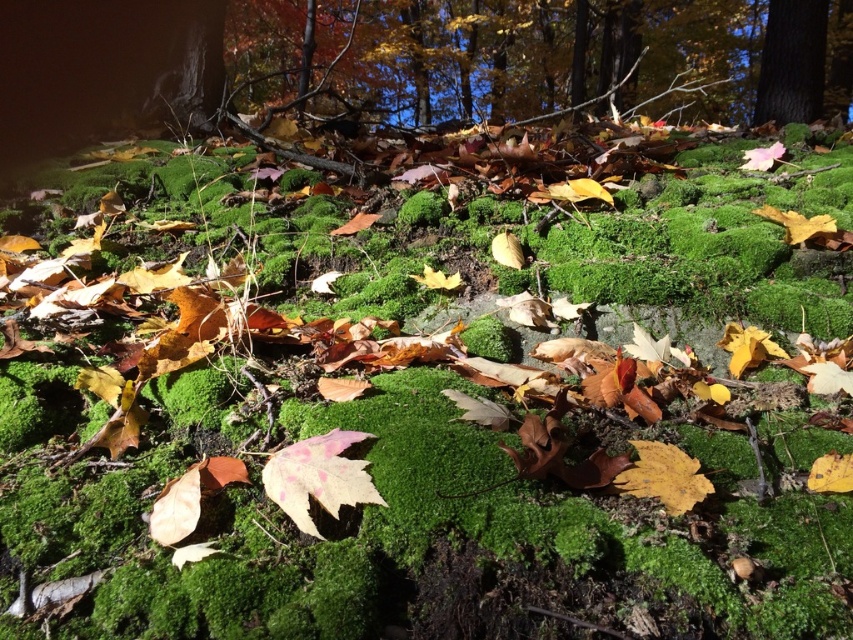
Looking at this image, is the position of autumn leaves at upper center more distant than that of smooth bark tree at upper right?

No.

Is point (343, 29) positioned behind point (753, 118)?

Yes, it is.

Does point (711, 3) come farther from viewer compared to point (782, 67)?

Yes.

The height and width of the screenshot is (640, 853). Find the location of `autumn leaves at upper center`. autumn leaves at upper center is located at coordinates (550, 52).